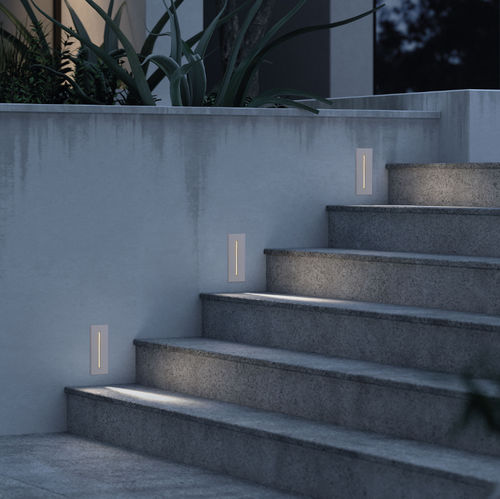
Where is `light glow`? Image resolution: width=500 pixels, height=499 pixels. light glow is located at coordinates (169, 397), (297, 297), (388, 204), (88, 22).